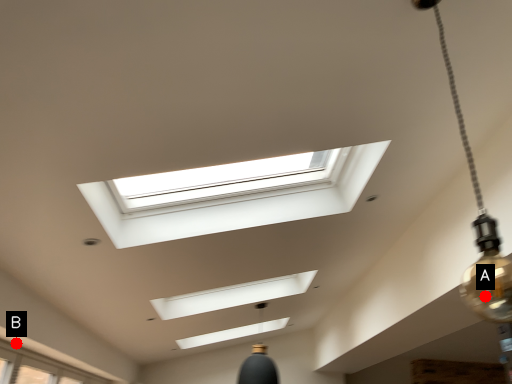
Question: Two points are circled on the image, labeled by A and B beside each circle. Which of the following is the closest to the observer?

Choices:
 (A) A is closer
 (B) B is closer

Answer: (A)